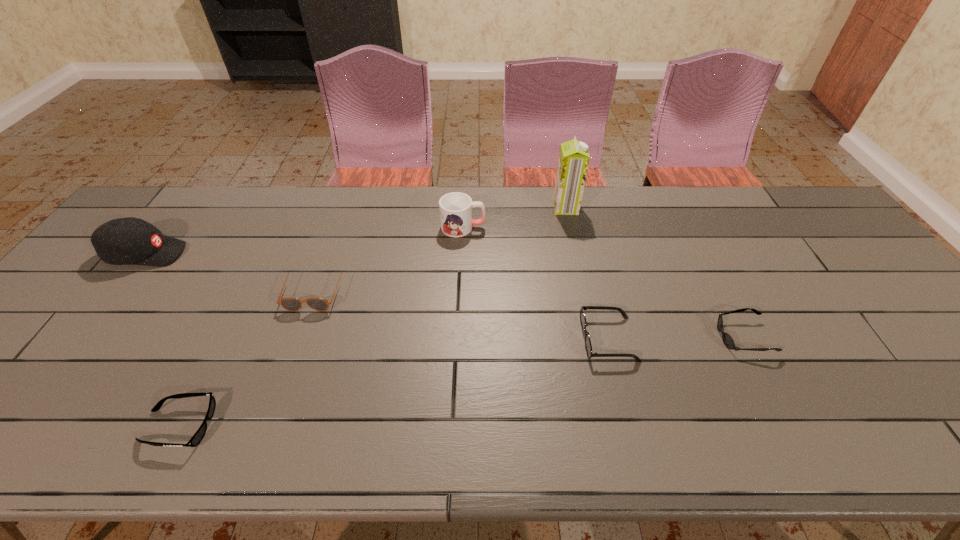
The image size is (960, 540). I want to click on soya milk, so click(573, 162).

The width and height of the screenshot is (960, 540). Find the location of `the tallest object`. the tallest object is located at coordinates (573, 162).

Identify the location of the leftmost object. click(x=124, y=241).

Image resolution: width=960 pixels, height=540 pixels. In order to click on mug in this screenshot , I will do `click(455, 208)`.

Where is `the third object from left to right`? the third object from left to right is located at coordinates (291, 304).

Where is `the third sunglasses from right to left`? The image size is (960, 540). the third sunglasses from right to left is located at coordinates (291, 304).

What are the coordinates of `the second sunglasses from right to left` in the screenshot? It's located at (588, 345).

Locate an element on the screen. the rightmost object is located at coordinates tap(728, 341).

The image size is (960, 540). What are the coordinates of `the nearest object` in the screenshot? It's located at (198, 436).

This screenshot has width=960, height=540. Find the location of `the sixth object from right to left`. the sixth object from right to left is located at coordinates (198, 436).